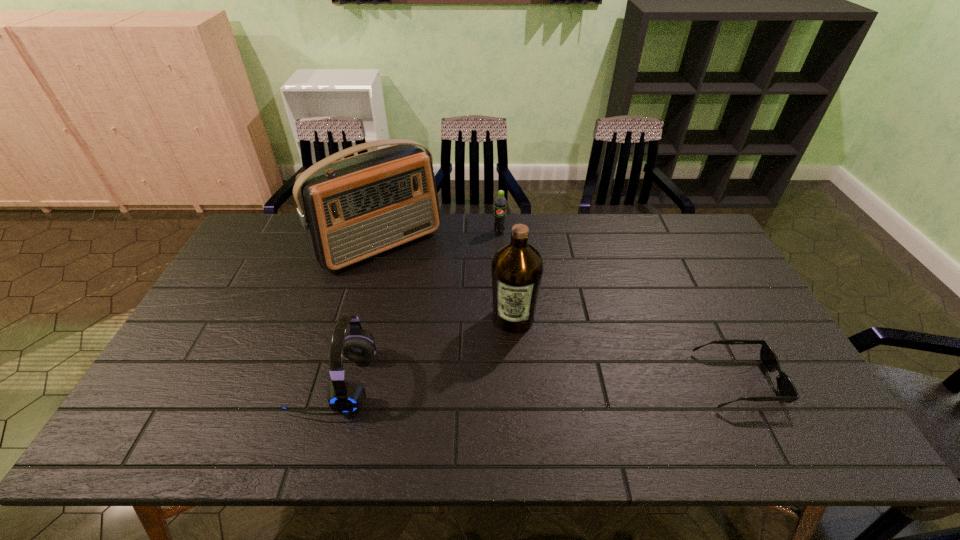
Find the location of a particular element. The height and width of the screenshot is (540, 960). headset is located at coordinates click(x=346, y=395).

Where is `the rightmost object`? Image resolution: width=960 pixels, height=540 pixels. the rightmost object is located at coordinates (788, 393).

At what (x,y) coordinates should I click in order to perform the action: click on the shortest object. Please return your answer as a coordinate pair (x, y). Looking at the image, I should click on (788, 393).

Locate an element on the screen. the second shortest object is located at coordinates coord(500,204).

Where is `olive oil`? Image resolution: width=960 pixels, height=540 pixels. olive oil is located at coordinates (517, 268).

Find the location of `radio receiver`. radio receiver is located at coordinates (352, 209).

Identify the location of vacant space located 0.110m on the ear cushions of the third tallest object. (250, 382).

Locate an element on the screen. This screenshot has width=960, height=540. vacant space located 0.140m on the ear cushions of the third tallest object is located at coordinates (238, 382).

In order to click on vacant space located 0.300m on the ear cushions of the third tallest object in this screenshot , I will do `click(174, 382)`.

You are a GUI agent. You are given a task and a screenshot of the screen. Output one action in this format:
    pyautogui.click(x=<x>, y=<y>)
    Task: Click on the vacant space located 0.360m on the front label of the soda
    Image resolution: width=960 pixels, height=540 pixels.
    Given the screenshot: What is the action you would take?
    pyautogui.click(x=493, y=311)